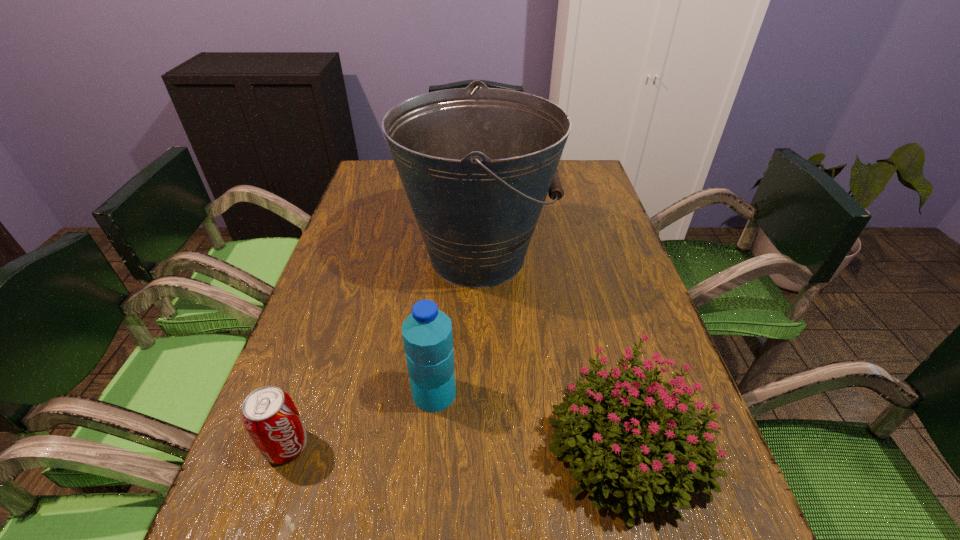
Identify the location of empty space that is in between the leftmost object and the water bottle. This screenshot has width=960, height=540. (360, 420).

Where is `vacant space that is in between the shortest object and the water bottle`? Image resolution: width=960 pixels, height=540 pixels. vacant space that is in between the shortest object and the water bottle is located at coordinates (360, 420).

Where is `empty space that is in between the farthest object and the water bottle`? The width and height of the screenshot is (960, 540). empty space that is in between the farthest object and the water bottle is located at coordinates (456, 325).

Locate an element on the screen. The image size is (960, 540). empty location between the leftmost object and the farthest object is located at coordinates (382, 351).

What are the coordinates of `blank region between the tallest object and the water bottle` in the screenshot? It's located at (456, 325).

Identify which object is located as the second nearest to the bouquet. Please provide its 2D coordinates. Your answer should be formatted as a tuple, i.e. [(x, y)], where the tuple contains the x and y coordinates of a point satisfying the conditions above.

[(476, 164)]

Identify which object is located as the second nearest to the water bottle. Please provide its 2D coordinates. Your answer should be formatted as a tuple, i.e. [(x, y)], where the tuple contains the x and y coordinates of a point satisfying the conditions above.

[(269, 415)]

Where is `free location that satisfies the following two spatial constraints: 1. with the handle on opposite sides of the farthest object; 2. on the front side of the leftmost object`? free location that satisfies the following two spatial constraints: 1. with the handle on opposite sides of the farthest object; 2. on the front side of the leftmost object is located at coordinates 476,446.

The height and width of the screenshot is (540, 960). I want to click on free space that satisfies the following two spatial constraints: 1. on the back side of the water bottle; 2. on the left side of the leftmost object, so click(305, 393).

The width and height of the screenshot is (960, 540). Find the location of `vacant region that satisfies the following two spatial constraints: 1. on the back side of the shortest object; 2. on the right side of the bouquet`. vacant region that satisfies the following two spatial constraints: 1. on the back side of the shortest object; 2. on the right side of the bouquet is located at coordinates (287, 443).